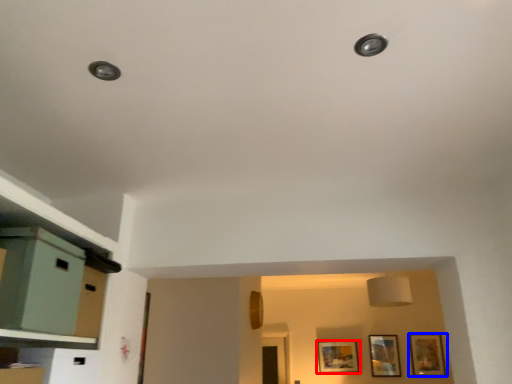
Question: Which point is further to the camera, picture frame (highlighted by a red box) or picture frame (highlighted by a blue box)?

Choices:
 (A) picture frame
 (B) picture frame

Answer: (A)